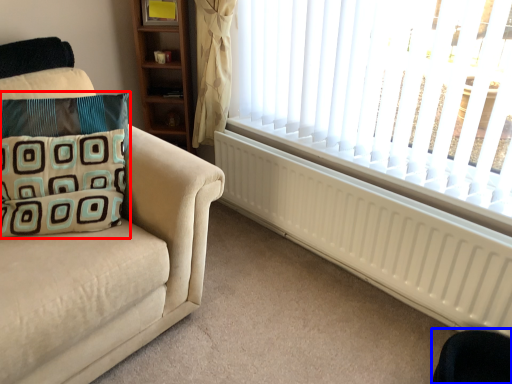
Question: Which of the following is the farthest to the observer, pillow (highlighted by a red box) or swivel chair (highlighted by a blue box)?

Choices:
 (A) pillow
 (B) swivel chair

Answer: (A)